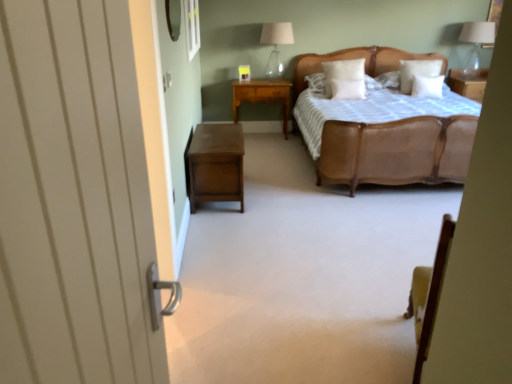
The width and height of the screenshot is (512, 384). What do you see at coordinates (426, 87) in the screenshot? I see `white soft pillow at upper center, marked as the fourth pillow in a left-to-right arrangement` at bounding box center [426, 87].

What do you see at coordinates (475, 45) in the screenshot? This screenshot has height=384, width=512. I see `transparent glass table lamp at upper right, the first table lamp in the right-to-left sequence` at bounding box center [475, 45].

How much space does white soft pillow at center, which appears as the third pillow when viewed from the right, occupy horizontally?

white soft pillow at center, which appears as the third pillow when viewed from the right, is 7.52 inches wide.

You are a GUI agent. You are given a task and a screenshot of the screen. Output one action in this format:
    pyautogui.click(x=<x>, y=<y>)
    Task: Click on the white soft pillow at center, the second pillow when ordered from left to right
    The height and width of the screenshot is (384, 512).
    Given the screenshot: What is the action you would take?
    pyautogui.click(x=347, y=89)

Find the location of a particular element. This screenshot has width=512, height=384. white wooden door at left is located at coordinates (73, 198).

Describe the element at coordinates (73, 198) in the screenshot. Image resolution: width=512 pixels, height=384 pixels. I see `white wooden door at left` at that location.

Measure the distance between point (255, 94) and camera.

The depth of point (255, 94) is 18.21 feet.

Measure the distance between light brown wood nightstand at center, which ranks as the 1th nightstand in back-to-front order, and camera.

light brown wood nightstand at center, which ranks as the 1th nightstand in back-to-front order, and camera are 5.34 meters apart.

Find the location of a particular element. The height and width of the screenshot is (384, 512). white soft pillow at upper center, the first pillow when ordered from right to left is located at coordinates (426, 87).

Can you confirm if white soft pillow at upper center, the third pillow positioned from the left, is wider than white soft pillow at center, which appears as the third pillow when viewed from the right?

Correct, the width of white soft pillow at upper center, the third pillow positioned from the left, exceeds that of white soft pillow at center, which appears as the third pillow when viewed from the right.

From a real-world perspective, which object stands above the other?

→ white soft pillow at upper center, which appears as the second pillow when viewed from the right, is physically above.

Does white soft pillow at upper center, the third pillow positioned from the left, turn towards white soft pillow at center, the second pillow when ordered from left to right?

No.

Considering the relative positions of transparent glass window at upper center and white wooden door at left in the image provided, is transparent glass window at upper center to the left or to the right of white wooden door at left?

Based on their positions, transparent glass window at upper center is located to the left of white wooden door at left.

From the image's perspective, who appears lower, transparent glass window at upper center or white wooden door at left?

From the image's view, white wooden door at left is below.

Based on the photo, does transparent glass window at upper center have a lesser height compared to white wooden door at left?

Correct, transparent glass window at upper center is not as tall as white wooden door at left.

Can you tell me how much transparent glass window at upper center and white wooden door at left differ in facing direction?

There is a 4.79-degree angle between the facing directions of transparent glass window at upper center and white wooden door at left.

Is white soft pillow at center, which appears as the third pillow when viewed from the right, touching white soft pillow at upper center, marked as the fourth pillow in a left-to-right arrangement?

No, white soft pillow at center, which appears as the third pillow when viewed from the right, is not touching white soft pillow at upper center, marked as the fourth pillow in a left-to-right arrangement.

From the image's perspective, is white soft pillow at center, the second pillow when ordered from left to right, below white soft pillow at upper center, the first pillow when ordered from right to left?

Yes, from the image's perspective, white soft pillow at center, the second pillow when ordered from left to right, is beneath white soft pillow at upper center, the first pillow when ordered from right to left.

Which of these two, white soft pillow at center, which appears as the third pillow when viewed from the right, or white soft pillow at upper center, the first pillow when ordered from right to left, is thinner?

With smaller width is white soft pillow at center, which appears as the third pillow when viewed from the right.

Which of these two, white soft pillow at center, which appears as the third pillow when viewed from the right, or white soft pillow at upper center, the first pillow when ordered from right to left, is bigger?

white soft pillow at upper center, the first pillow when ordered from right to left.

Between transparent glass table lamp at upper right, the first table lamp in the right-to-left sequence, and metallic reflective mirror at upper center, which one appears on the right side from the viewer's perspective?

Positioned to the right is transparent glass table lamp at upper right, the first table lamp in the right-to-left sequence.

Would you say transparent glass table lamp at upper right, which is the second table lamp from left to right, contains metallic reflective mirror at upper center?

No, transparent glass table lamp at upper right, which is the second table lamp from left to right, does not contain metallic reflective mirror at upper center.

From the image's perspective, does transparent glass table lamp at upper right, which is the second table lamp from left to right, appear lower than metallic reflective mirror at upper center?

No, from the image's perspective, transparent glass table lamp at upper right, which is the second table lamp from left to right, is not below metallic reflective mirror at upper center.

Is the position of transparent glass table lamp at upper right, the first table lamp in the right-to-left sequence, more distant than that of metallic reflective mirror at upper center?

That is True.

Consider the image. Is white soft pillow at center, which is the fourth pillow in right-to-left order, aimed at light brown wood nightstand at center, positioned as the first nightstand in top-to-bottom order?

No, white soft pillow at center, which is the fourth pillow in right-to-left order, is not facing towards light brown wood nightstand at center, positioned as the first nightstand in top-to-bottom order.

How different are the orientations of white soft pillow at center, which ranks as the 1th pillow in left-to-right order, and light brown wood nightstand at center, positioned as the first nightstand in top-to-bottom order, in degrees?

white soft pillow at center, which ranks as the 1th pillow in left-to-right order, and light brown wood nightstand at center, positioned as the first nightstand in top-to-bottom order, are facing 0.414 degrees away from each other.

Can we say white soft pillow at center, which is the fourth pillow in right-to-left order, lies outside light brown wood nightstand at center, which is counted as the second nightstand, starting from the front?

Yes.

Considering the relative sizes of white soft pillow at center, which is the fourth pillow in right-to-left order, and light brown wood nightstand at center, which is counted as the 2th nightstand, starting from the bottom, in the image provided, is white soft pillow at center, which is the fourth pillow in right-to-left order, wider than light brown wood nightstand at center, which is counted as the 2th nightstand, starting from the bottom,?

In fact, white soft pillow at center, which is the fourth pillow in right-to-left order, might be narrower than light brown wood nightstand at center, which is counted as the 2th nightstand, starting from the bottom.

From a real-world perspective, which is physically below, clear glass table lamp at upper center, which is the 2th table lamp in right-to-left order, or metallic reflective mirror at upper center?

From a 3D spatial view, clear glass table lamp at upper center, which is the 2th table lamp in right-to-left order, is below.

From the image's perspective, which is above, clear glass table lamp at upper center, which is the 2th table lamp in right-to-left order, or metallic reflective mirror at upper center?

clear glass table lamp at upper center, which is the 2th table lamp in right-to-left order, from the image's perspective.

Considering the sizes of objects clear glass table lamp at upper center, which appears as the 1th table lamp when viewed from the left, and metallic reflective mirror at upper center in the image provided, who is taller, clear glass table lamp at upper center, which appears as the 1th table lamp when viewed from the left, or metallic reflective mirror at upper center?

clear glass table lamp at upper center, which appears as the 1th table lamp when viewed from the left, is taller.

Can we say brown wood nightstand at lower left, which appears as the first nightstand when ordered from the bottom, lies outside transparent glass window at upper center?

brown wood nightstand at lower left, which appears as the first nightstand when ordered from the bottom, lies outside transparent glass window at upper center's area.

Does brown wood nightstand at lower left, which appears as the first nightstand when ordered from the bottom, have a smaller size compared to transparent glass window at upper center?

Incorrect, brown wood nightstand at lower left, which appears as the first nightstand when ordered from the bottom, is not smaller in size than transparent glass window at upper center.

Does brown wood nightstand at lower left, marked as the 2th nightstand in a top-to-bottom arrangement, touch transparent glass window at upper center?

brown wood nightstand at lower left, marked as the 2th nightstand in a top-to-bottom arrangement, and transparent glass window at upper center are clearly separated.

Considering the points (237, 187) and (195, 8), which point is in front, point (237, 187) or point (195, 8)?

The point (237, 187) is in front.

The height and width of the screenshot is (384, 512). Find the location of `the 2nd pillow above the white soft pillow at center, the second pillow when ordered from left to right (from the image's perspective)`. the 2nd pillow above the white soft pillow at center, the second pillow when ordered from left to right (from the image's perspective) is located at coordinates (417, 71).

The width and height of the screenshot is (512, 384). I want to click on window located on the left of white wooden door at left, so click(x=192, y=27).

When comparing their distances from white wooden door at left, does clear glass table lamp at upper center, which is the 2th table lamp in right-to-left order, or transparent glass table lamp at upper right, the first table lamp in the right-to-left sequence, seem closer?

transparent glass table lamp at upper right, the first table lamp in the right-to-left sequence.

Considering their positions, is clear glass table lamp at upper center, which is the 2th table lamp in right-to-left order, positioned further to white soft pillow at center, which ranks as the 1th pillow in left-to-right order, than light brown wood nightstand at center, which is counted as the second nightstand, starting from the front?

Based on the image, clear glass table lamp at upper center, which is the 2th table lamp in right-to-left order, appears to be further to white soft pillow at center, which ranks as the 1th pillow in left-to-right order.

From the image, which object appears to be nearer to leather bed at center, white soft pillow at center, the second pillow when ordered from left to right, or white soft pillow at upper center, the third pillow positioned from the left?

white soft pillow at center, the second pillow when ordered from left to right, is positioned closer to the anchor leather bed at center.

Which object lies nearer to the anchor point transparent glass table lamp at upper right, the first table lamp in the right-to-left sequence, light brown wood nightstand at center, positioned as the first nightstand in top-to-bottom order, or metallic reflective mirror at upper center?

light brown wood nightstand at center, positioned as the first nightstand in top-to-bottom order, lies closer to transparent glass table lamp at upper right, the first table lamp in the right-to-left sequence, than the other object.

From the image, which object appears to be farther from brown wood nightstand at lower left, the first nightstand in the front-to-back sequence, white soft pillow at upper center, marked as the fourth pillow in a left-to-right arrangement, or leather bed at center?

The object further to brown wood nightstand at lower left, the first nightstand in the front-to-back sequence, is white soft pillow at upper center, marked as the fourth pillow in a left-to-right arrangement.

Which object lies further to the anchor point clear glass table lamp at upper center, which appears as the 1th table lamp when viewed from the left, transparent glass table lamp at upper right, which is the second table lamp from left to right, or white soft pillow at center, the second pillow when ordered from left to right?

transparent glass table lamp at upper right, which is the second table lamp from left to right, is positioned further to the anchor clear glass table lamp at upper center, which appears as the 1th table lamp when viewed from the left.

Based on their spatial positions, is white soft pillow at center, the second pillow when ordered from left to right, or white soft pillow at center, which is the fourth pillow in right-to-left order, closer to transparent glass window at upper center?

white soft pillow at center, the second pillow when ordered from left to right.

Estimate the real-world distances between objects in this image. Which object is closer to light brown wood nightstand at center, which ranks as the 1th nightstand in back-to-front order, white soft pillow at center, which ranks as the 1th pillow in left-to-right order, or leather bed at center?

The object closer to light brown wood nightstand at center, which ranks as the 1th nightstand in back-to-front order, is white soft pillow at center, which ranks as the 1th pillow in left-to-right order.

I want to click on pillow between metallic reflective mirror at upper center and white soft pillow at center, which appears as the third pillow when viewed from the right, in the front-back direction, so point(426,87).

Find the location of a particular element. mirror between transparent glass window at upper center and transparent glass table lamp at upper right, which is the second table lamp from left to right, from left to right is located at coordinates (173, 18).

Identify the location of bed between transparent glass window at upper center and transparent glass table lamp at upper right, the first table lamp in the right-to-left sequence. Image resolution: width=512 pixels, height=384 pixels. (396, 151).

Locate an element on the screen. The height and width of the screenshot is (384, 512). pillow between light brown wood nightstand at center, positioned as the first nightstand in top-to-bottom order, and white soft pillow at center, the second pillow when ordered from left to right is located at coordinates (345, 79).